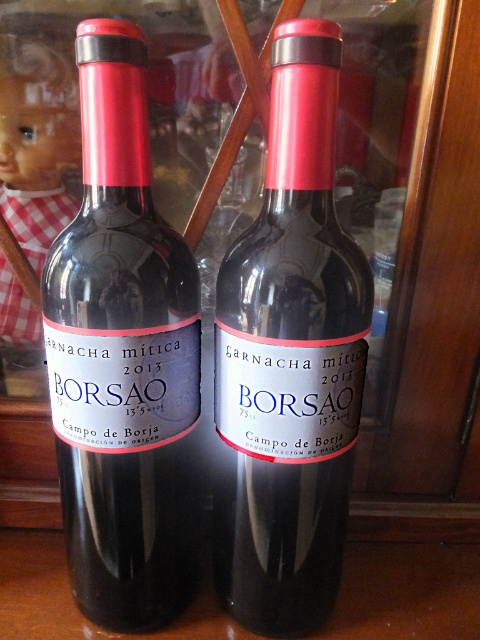
Question: Which point appears closest to the camera in this image?

Choices:
 (A) click(12, 220)
 (B) click(99, 154)

Answer: (B)

Question: Which of the following is the closest to the observer?

Choices:
 (A) (167, 365)
 (B) (310, 164)
 (C) (39, 48)

Answer: (B)

Question: Among these points, which one is nearest to the camera?

Choices:
 (A) (304, 182)
 (B) (46, 164)
 (C) (117, 522)

Answer: (A)

Question: Can you confirm if matte black bottle at left is bigger than matte glass wine bottle at center?

Choices:
 (A) no
 (B) yes

Answer: (A)

Question: From the image, what is the correct spatial relationship of matte glass wine bottle at center in relation to matte plastic doll at left?

Choices:
 (A) above
 (B) below

Answer: (B)

Question: From the image, what is the correct spatial relationship of matte black bottle at left in relation to matte glass wine bottle at center?

Choices:
 (A) left
 (B) right

Answer: (A)